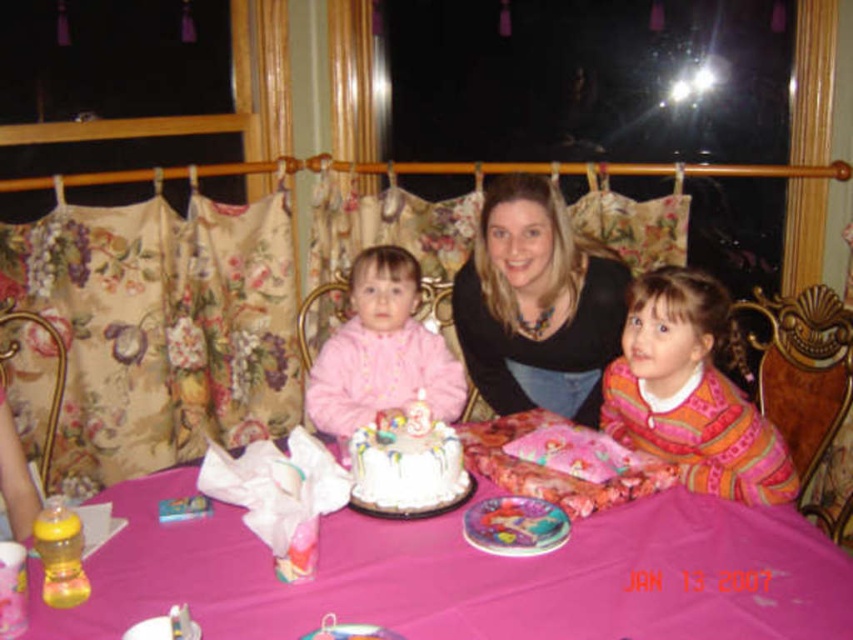
You are a photographer trying to capture a group photo of the birthday celebration. You notice two people wearing a matte black sweater at center and a pink fleece jacket at center. If you want to ensure both individuals are fully visible in the frame, which clothing item should you position closer to the camera?

You should position the matte black sweater at center closer to the camera because it might be wider than the pink fleece jacket at center, ensuring both are fully visible.

You are a photographer at the birthday party and want to take a group photo. You need to ensure that both the matte black sweater at center and the pink fleece jacket at center are visible in the frame. Given their sizes, which one might you need to adjust the camera angle to better include in the shot?

The matte black sweater at center is larger in size than the pink fleece jacket at center, so you might need to adjust the camera angle to better include the matte black sweater at center in the frame.

Consider the image. You are standing at the point labeled as point (552,362) and want to walk towards the point labeled as point (409,468). Which direction should you move to get closer to your destination?

You should move forward because point (552,362) is behind point (409,468), so moving forward will bring you closer to the destination.